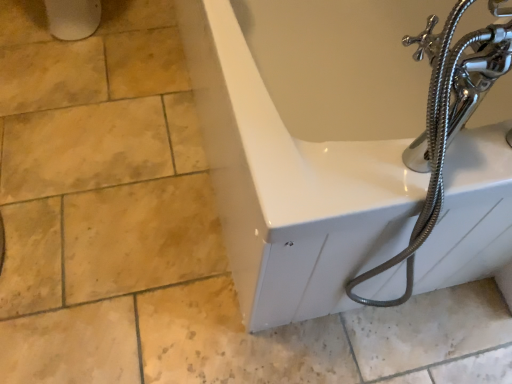
What is the approximate height of metallic silver garden hose at right?

metallic silver garden hose at right is 27.68 inches tall.

Identify the location of metallic silver garden hose at right. This screenshot has width=512, height=384. (444, 118).

What do you see at coordinates (444, 118) in the screenshot? The image size is (512, 384). I see `metallic silver garden hose at right` at bounding box center [444, 118].

What do you see at coordinates (306, 147) in the screenshot? This screenshot has height=384, width=512. I see `white glossy bathtub at upper right` at bounding box center [306, 147].

What is the approximate height of white glossy bathtub at upper right?

white glossy bathtub at upper right is 23.08 inches in height.

Find the location of `white glossy bathtub at upper right`. white glossy bathtub at upper right is located at coordinates (306, 147).

In order to click on metallic silver garden hose at right in this screenshot , I will do `click(444, 118)`.

Can you confirm if metallic silver garden hose at right is positioned to the right of white glossy bathtub at upper right?

Indeed, metallic silver garden hose at right is positioned on the right side of white glossy bathtub at upper right.

Is metallic silver garden hose at right in front of white glossy bathtub at upper right?

Yes, metallic silver garden hose at right is closer to the viewer.

Is point (403, 298) closer or farther from the camera than point (184, 15)?

Point (403, 298).

From the image's perspective, is metallic silver garden hose at right on white glossy bathtub at upper right?

No.

Consider the image. From a real-world perspective, is metallic silver garden hose at right positioned over white glossy bathtub at upper right based on gravity?

Yes, from a real-world perspective, metallic silver garden hose at right is over white glossy bathtub at upper right

Looking at their sizes, would you say metallic silver garden hose at right is wider or thinner than white glossy bathtub at upper right?

In the image, metallic silver garden hose at right appears to be more narrow than white glossy bathtub at upper right.

Based on the photo, between metallic silver garden hose at right and white glossy bathtub at upper right, which one has more height?

metallic silver garden hose at right.

In terms of size, does metallic silver garden hose at right appear bigger or smaller than white glossy bathtub at upper right?

In the image, metallic silver garden hose at right appears to be smaller than white glossy bathtub at upper right.

Is metallic silver garden hose at right located outside white glossy bathtub at upper right?

No, metallic silver garden hose at right is not outside of white glossy bathtub at upper right.

Is metallic silver garden hose at right not near white glossy bathtub at upper right?

That's not correct — metallic silver garden hose at right is a little close to white glossy bathtub at upper right.

Does metallic silver garden hose at right turn towards white glossy bathtub at upper right?

Yes, metallic silver garden hose at right is oriented towards white glossy bathtub at upper right.

In order to click on garden hose above the white glossy bathtub at upper right (from a real-world perspective) in this screenshot , I will do `click(444, 118)`.

Which object is positioned more to the right, white glossy bathtub at upper right or metallic silver garden hose at right?

From the viewer's perspective, metallic silver garden hose at right appears more on the right side.

Considering the relative positions of white glossy bathtub at upper right and metallic silver garden hose at right in the image provided, is white glossy bathtub at upper right behind metallic silver garden hose at right?

Yes, white glossy bathtub at upper right is behind metallic silver garden hose at right.

Is point (386, 142) farther from camera compared to point (451, 62)?

Yes, it is behind point (451, 62).

From the image's perspective, which is above, white glossy bathtub at upper right or metallic silver garden hose at right?

white glossy bathtub at upper right.

From a real-world perspective, is white glossy bathtub at upper right located higher than metallic silver garden hose at right?

No, from a real-world perspective, white glossy bathtub at upper right is not on top of metallic silver garden hose at right.

Is white glossy bathtub at upper right wider than metallic silver garden hose at right?

Yes, white glossy bathtub at upper right is wider than metallic silver garden hose at right.

Considering the sizes of white glossy bathtub at upper right and metallic silver garden hose at right in the image, is white glossy bathtub at upper right taller or shorter than metallic silver garden hose at right?

Considering their sizes, white glossy bathtub at upper right has less height than metallic silver garden hose at right.

Between white glossy bathtub at upper right and metallic silver garden hose at right, which one has larger size?

Bigger between the two is white glossy bathtub at upper right.

Is metallic silver garden hose at right completely or partially inside white glossy bathtub at upper right?

Yes, metallic silver garden hose at right is surrounded by white glossy bathtub at upper right.

Are white glossy bathtub at upper right and metallic silver garden hose at right making contact?

white glossy bathtub at upper right and metallic silver garden hose at right are not in contact.

Is white glossy bathtub at upper right facing away from metallic silver garden hose at right?

No, white glossy bathtub at upper right's orientation is not away from metallic silver garden hose at right.

At what (x,y) coordinates should I click in order to perform the action: click on garden hose that is in front of the white glossy bathtub at upper right. Please return your answer as a coordinate pair (x, y). The height and width of the screenshot is (384, 512). Looking at the image, I should click on (444, 118).

You are a GUI agent. You are given a task and a screenshot of the screen. Output one action in this format:
    pyautogui.click(x=<x>, y=<y>)
    Task: Click on the garden hose in front of the white glossy bathtub at upper right
    The image size is (512, 384).
    Given the screenshot: What is the action you would take?
    pyautogui.click(x=444, y=118)

The width and height of the screenshot is (512, 384). In order to click on bathtub to the left of metallic silver garden hose at right in this screenshot , I will do `click(306, 147)`.